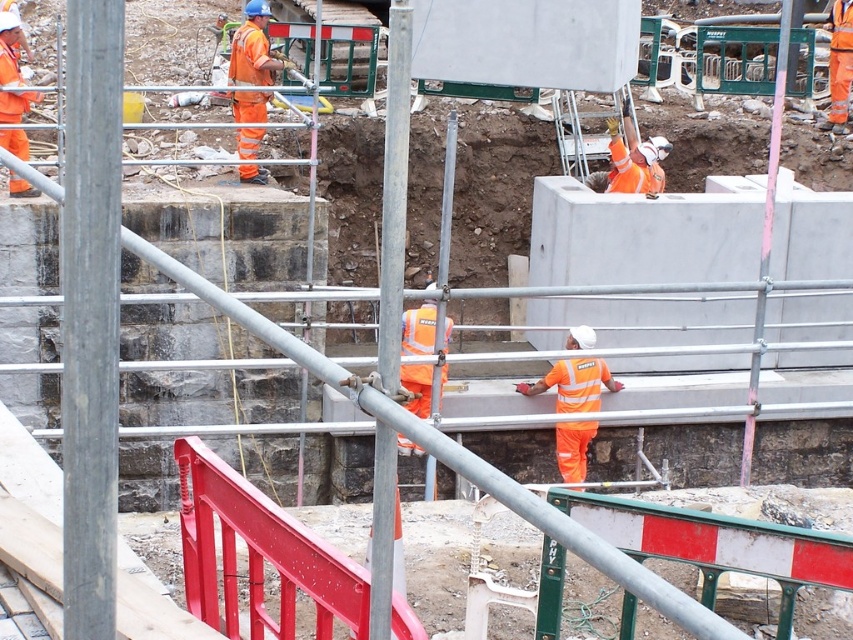
Question: Which of the following is the closest to the observer?

Choices:
 (A) (561, 403)
 (B) (254, 10)

Answer: (A)

Question: Can you confirm if orange reflective vest at center is positioned above orange reflective workwear at upper center?

Choices:
 (A) no
 (B) yes

Answer: (A)

Question: Which point is farther to the camera?

Choices:
 (A) (589, 381)
 (B) (259, 96)

Answer: (B)

Question: Does orange reflective vest at center appear on the left side of orange reflective workwear at upper center?

Choices:
 (A) yes
 (B) no

Answer: (B)

Question: Does orange reflective vest at center appear over orange reflective workwear at upper center?

Choices:
 (A) yes
 (B) no

Answer: (B)